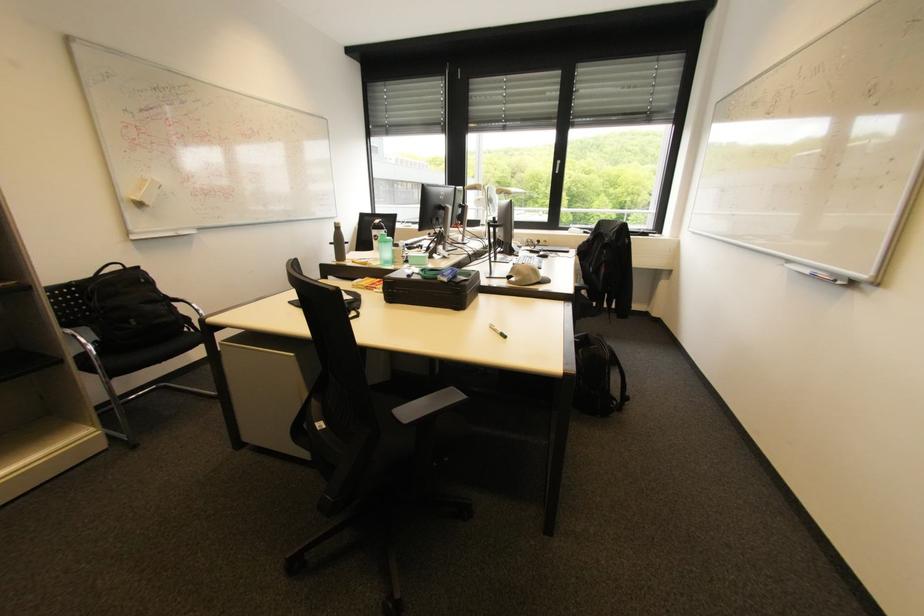
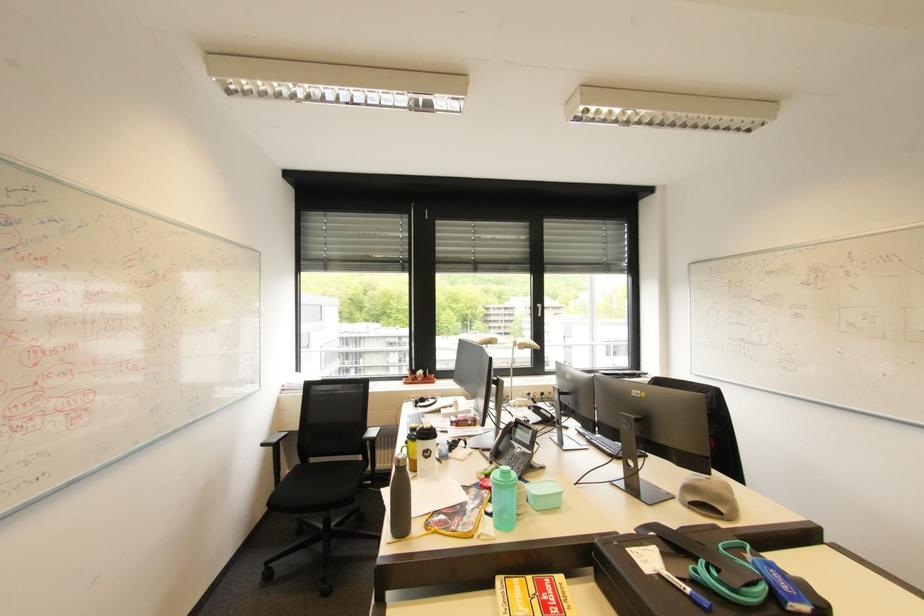
Find the pixel in the second image that matches [444,280] in the first image.

(795, 610)